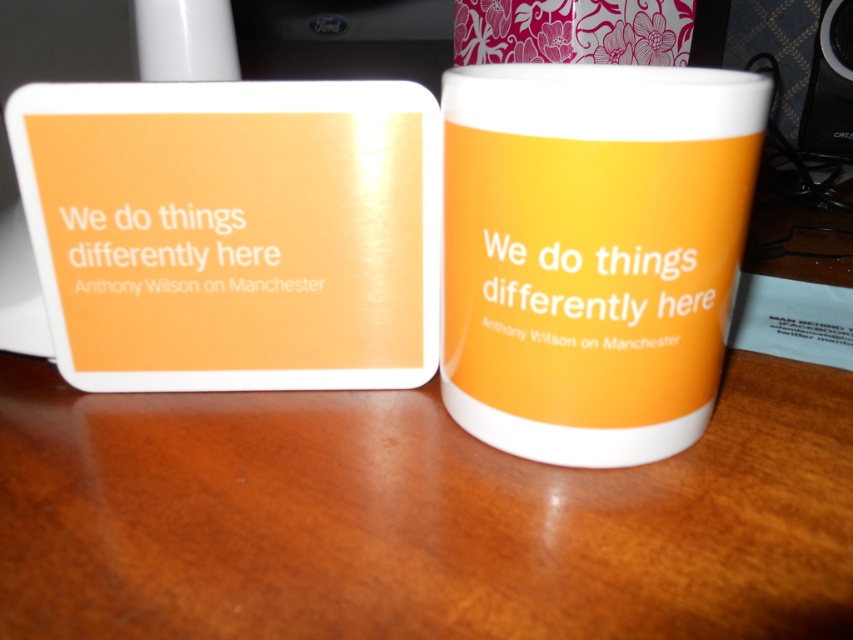
You are organizing a small event and need to place a decorative item closer to the attendees. Given the current arrangement, which object should you choose between the matte ceramic mug at center and the black plastic speaker at upper right?

The matte ceramic mug at center is in front of the black plastic speaker at upper right, so you should choose the matte ceramic mug at center as it is already closer to the attendees.

You have a matte ceramic mug at center and a black plastic speaker at upper right. Which object is larger in size?

The matte ceramic mug at center is bigger than the black plastic speaker at upper right.

What are the coordinates of the matte ceramic mug at center?

The coordinates of the matte ceramic mug at center are at point (592, 252).